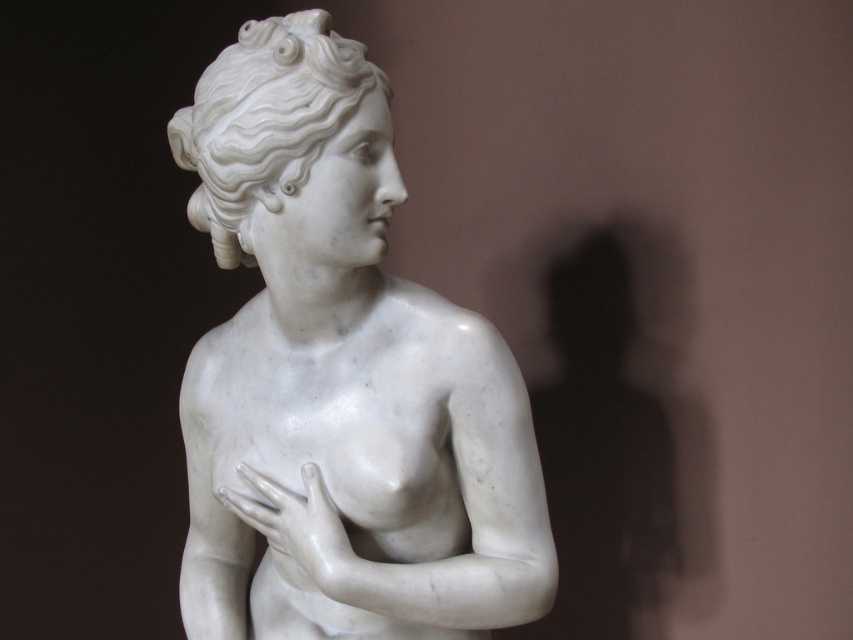
Between white marble statue at center and white marble hand at center, which one is positioned lower?

Positioned lower is white marble hand at center.

Locate an element on the screen. The image size is (853, 640). white marble statue at center is located at coordinates (340, 378).

In order to click on white marble statue at center in this screenshot , I will do `click(340, 378)`.